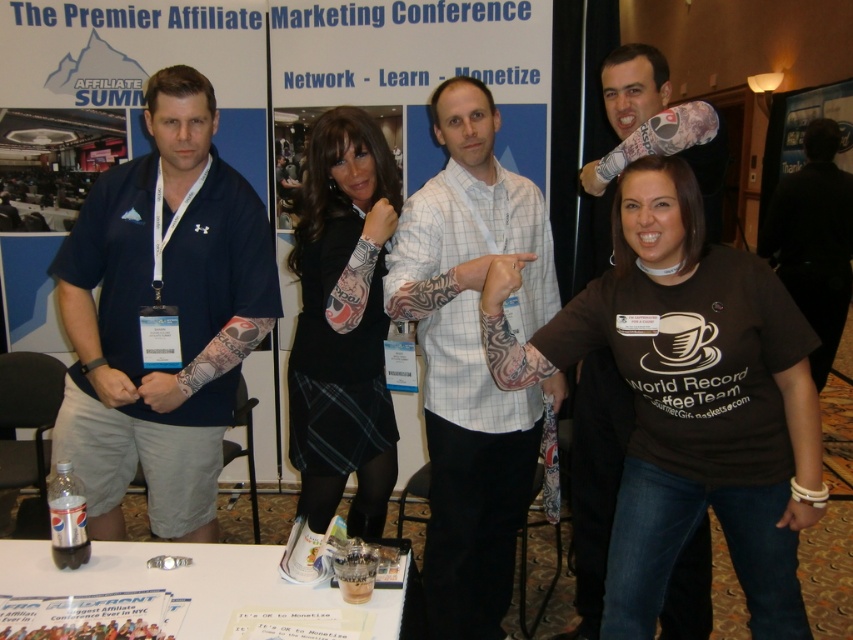
Is clear plastic cup at lower center taller than black shirt at right?

No.

Which is above, clear plastic cup at lower center or black shirt at right?

Positioned higher is black shirt at right.

Between point (390, 616) and point (799, 272), which one is positioned behind?

The point (799, 272) is more distant.

Locate an element on the screen. Image resolution: width=853 pixels, height=640 pixels. clear plastic cup at lower center is located at coordinates (184, 580).

Locate an element on the screen. The width and height of the screenshot is (853, 640). dark blue shirt at center is located at coordinates (595, 477).

Does point (616, 77) come in front of point (79, 589)?

No.

Describe the element at coordinates (595, 477) in the screenshot. I see `dark blue shirt at center` at that location.

The height and width of the screenshot is (640, 853). Find the location of `dark blue shirt at center`. dark blue shirt at center is located at coordinates (595, 477).

Which of these two, brown cotton t-shirt at center or black shirt at right, stands taller?

black shirt at right is taller.

Looking at this image, is brown cotton t-shirt at center bigger than black shirt at right?

Actually, brown cotton t-shirt at center might be smaller than black shirt at right.

You are a GUI agent. You are given a task and a screenshot of the screen. Output one action in this format:
    pyautogui.click(x=<x>, y=<y>)
    Task: Click on the brown cotton t-shirt at center
    The width and height of the screenshot is (853, 640).
    Given the screenshot: What is the action you would take?
    pyautogui.click(x=688, y=401)

You are a GUI agent. You are given a task and a screenshot of the screen. Output one action in this format:
    pyautogui.click(x=<x>, y=<y>)
    Task: Click on the brown cotton t-shirt at center
    
    Given the screenshot: What is the action you would take?
    [688, 401]